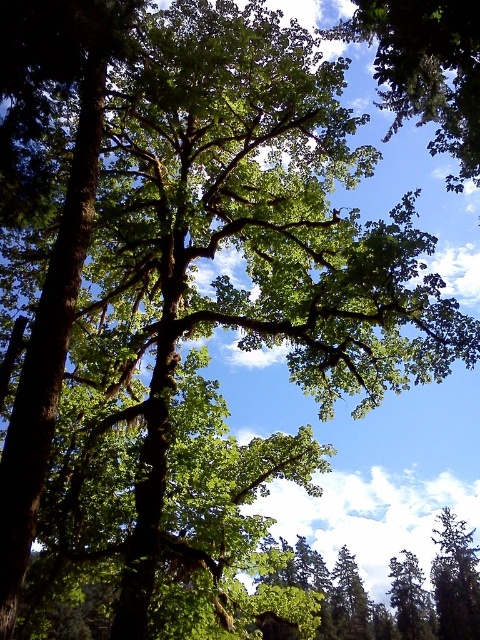
You are a bird flying over the forest. You see the green leafy tree at upper center and the green leafy tree at lower right. Which tree is closer to you?

The green leafy tree at upper center is closer to you because it is in front of the green leafy tree at lower right.

You are a bird flying over the forest. You see the green leafy tree at upper center and the green leafy tree at lower right. Which tree would you land on first if you are flying straight down?

The green leafy tree at upper center is located above the green leafy tree at lower right, so if you are flying straight down, you would reach the green leafy tree at upper center first before the lower one.

You are standing in the forest looking at the large tree. There are two points marked on the tree trunk. The first point is at coordinate point (435, 56) and the second is at point (443, 618). Which of these points is closer to you?

Point (435, 56) is closer to the camera than point (443, 618).